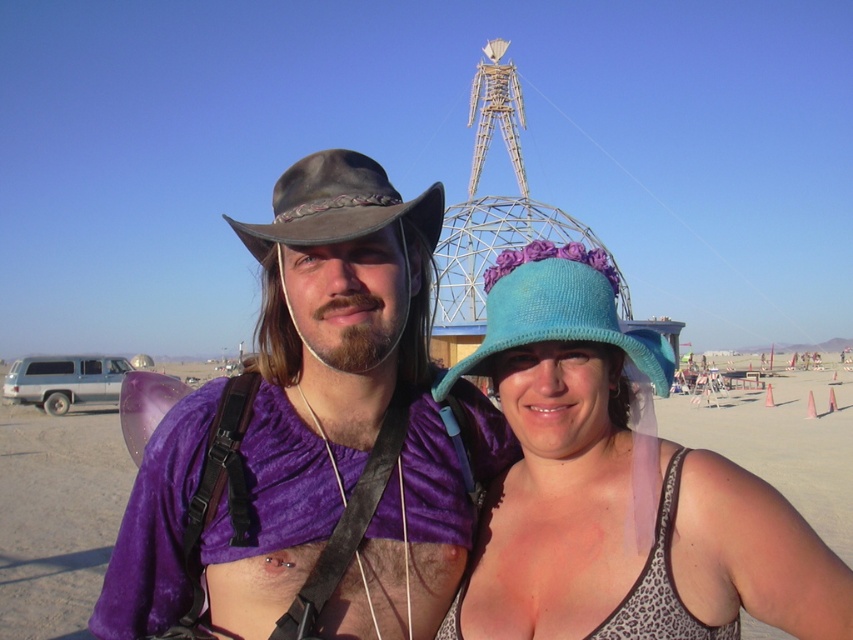
Between blue knitted hat at center and brown felt cowboy hat at center, which one has more height?

Standing taller between the two is blue knitted hat at center.

In the scene shown: Which is more to the left, blue knitted hat at center or brown felt cowboy hat at center?

From the viewer's perspective, brown felt cowboy hat at center appears more on the left side.

Where is `blue knitted hat at center`? The height and width of the screenshot is (640, 853). blue knitted hat at center is located at coordinates (618, 486).

Between point (311, 356) and point (109, 456), which one is positioned in front?

Point (311, 356) is in front.

Can you confirm if velvet purple shirt at center is smaller than purple fabric at center?

Yes.

The image size is (853, 640). In order to click on velvet purple shirt at center in this screenshot , I will do `click(314, 440)`.

Between turquoise knitted hat at center and brown felt cowboy hat at center, which one is positioned higher?

brown felt cowboy hat at center is higher up.

Can you confirm if turquoise knitted hat at center is shorter than brown felt cowboy hat at center?

Indeed, turquoise knitted hat at center has a lesser height compared to brown felt cowboy hat at center.

Between point (593, 324) and point (322, 204), which one is positioned in front?

Point (593, 324) is in front.

I want to click on turquoise knitted hat at center, so click(556, 310).